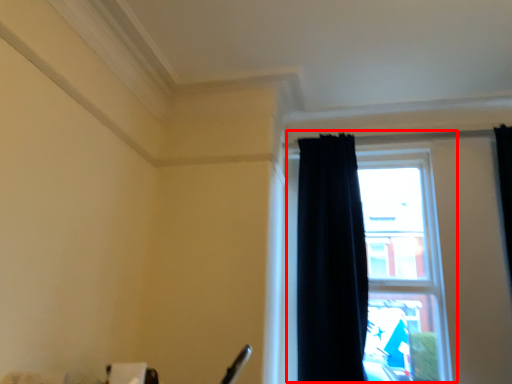
Question: Observing the image, what is the correct spatial positioning of window (annotated by the red box) in reference to curtain?

Choices:
 (A) left
 (B) right

Answer: (B)